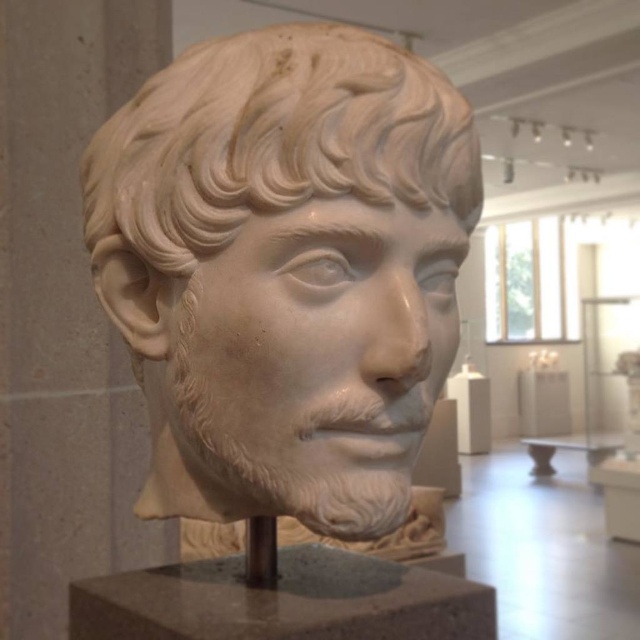
You are a visitor in the museum standing at the entrance. You notice two points marked in the image. The first point is at coordinates point (168, 284) and the second is at point (214, 589). Which point is closer to you as you stand at the entrance?

Point (168, 284) is in front of point (214, 589), so the first point is closer to you.